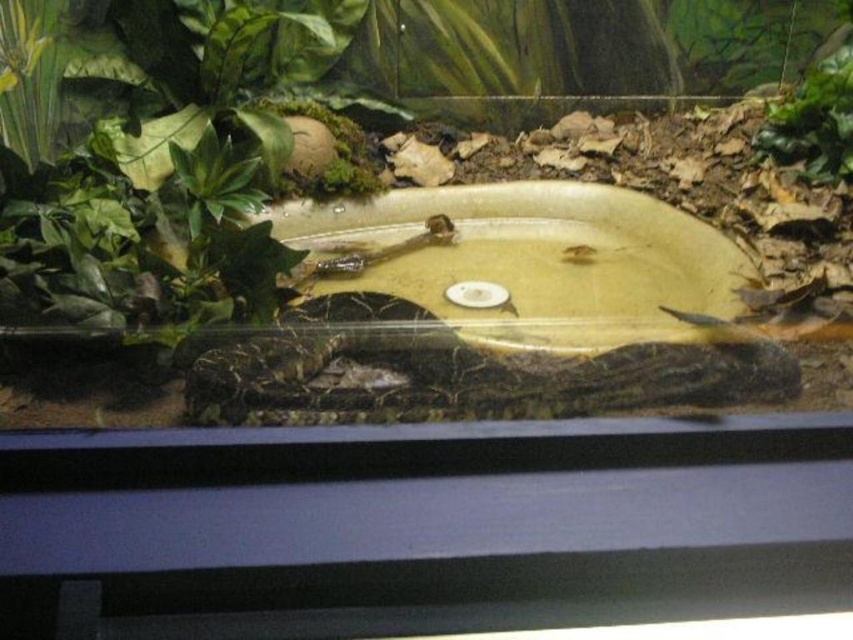
You are a reptile keeper checking the vivarium. You need to place a new heat lamp that must be positioned above the leathery brown snake at center to ensure proper basking. Given the vivarium layout, where should you position the heat lamp relative to the snake?

The heat lamp should be positioned directly above the leathery brown snake at center since it is located at point (x=476, y=376), which is the central area of the enclosure.

You are a reptile keeper checking the vivarium. You need to ensure that the leathery brown snake at center has enough space to move around without being obstructed by the green matte leaf at upper right. Is the size difference between them a concern for the snake?

The leathery brown snake at center is bigger than the green matte leaf at upper right, so the size difference is not a concern for the snake as it can easily move around the smaller leaf.

You are a new pet owner setting up a vivarium for your pet snake. You have placed a green matte leaf at upper right and a leathery brown snake at center. Where should you position the water dish to ensure the snake can easily access it without disturbing the leaf?

The water dish should be placed away from the green matte leaf at upper right and the leathery brown snake at center to avoid disturbing the leaf and ensure easy access for the snake.